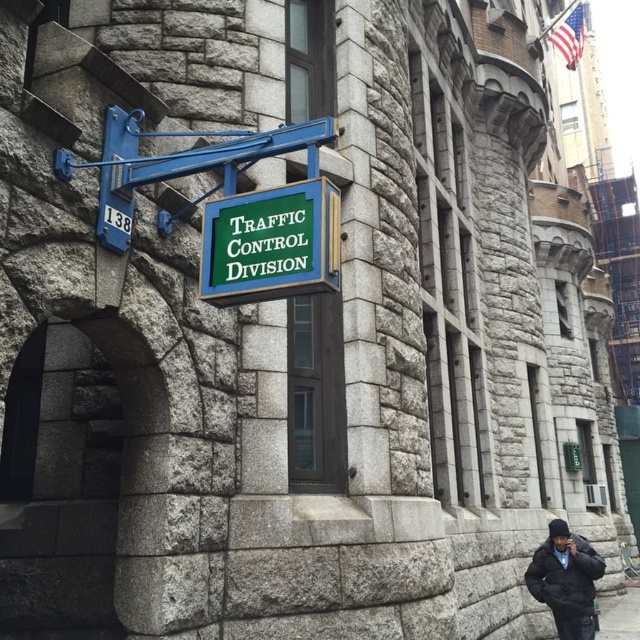
Question: Does black matte jacket at lower right come behind gray concrete pavement at lower right?

Choices:
 (A) yes
 (B) no

Answer: (B)

Question: Is green plastic sign at center positioned behind gray concrete pavement at lower right?

Choices:
 (A) no
 (B) yes

Answer: (A)

Question: Is black matte jacket at lower right positioned before gray concrete pavement at lower right?

Choices:
 (A) no
 (B) yes

Answer: (B)

Question: Which object appears closest to the camera in this image?

Choices:
 (A) green plastic sign at center
 (B) gray concrete pavement at lower right

Answer: (A)

Question: Which of the following is the farthest from the observer?

Choices:
 (A) (620, 637)
 (B) (307, 248)
 (C) (600, 560)

Answer: (A)

Question: Which object is closer to the camera taking this photo?

Choices:
 (A) green plastic sign at center
 (B) black matte jacket at lower right
 (C) gray concrete pavement at lower right

Answer: (A)